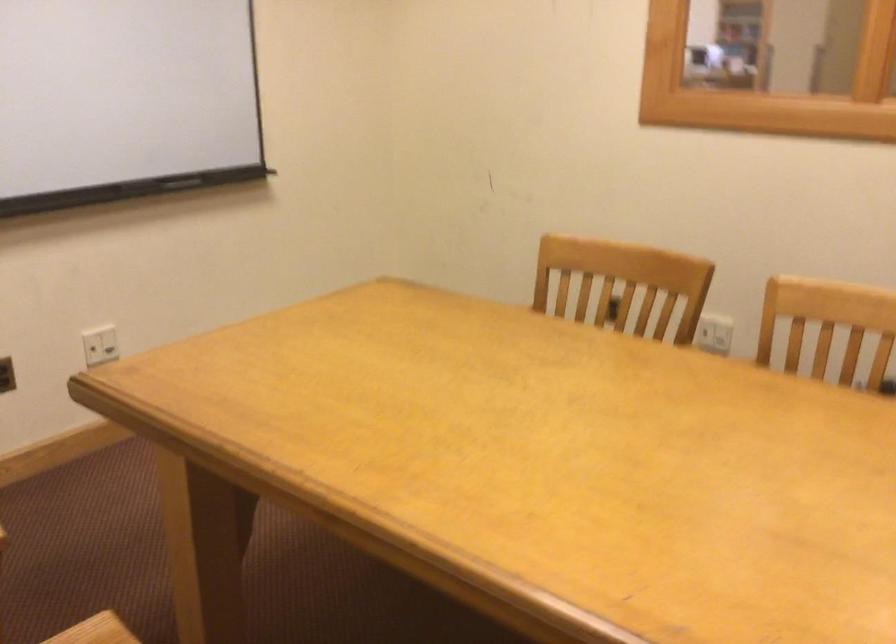
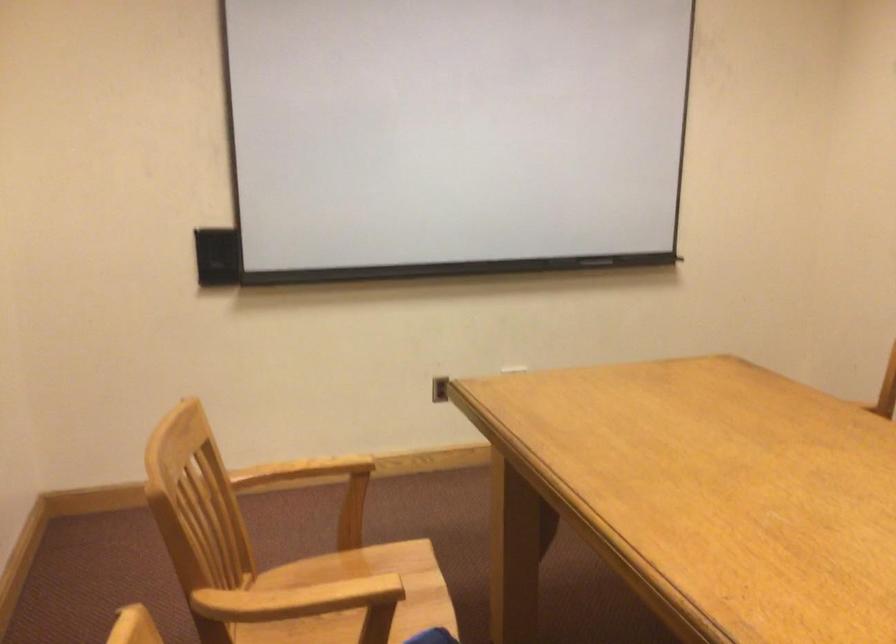
Question: The camera is either moving clockwise (left) or counter-clockwise (right) around the object. The first image is from the beginning of the video and the second image is from the end. Is the camera moving left or right when shooting the video?

Choices:
 (A) Left
 (B) Right

Answer: (B)